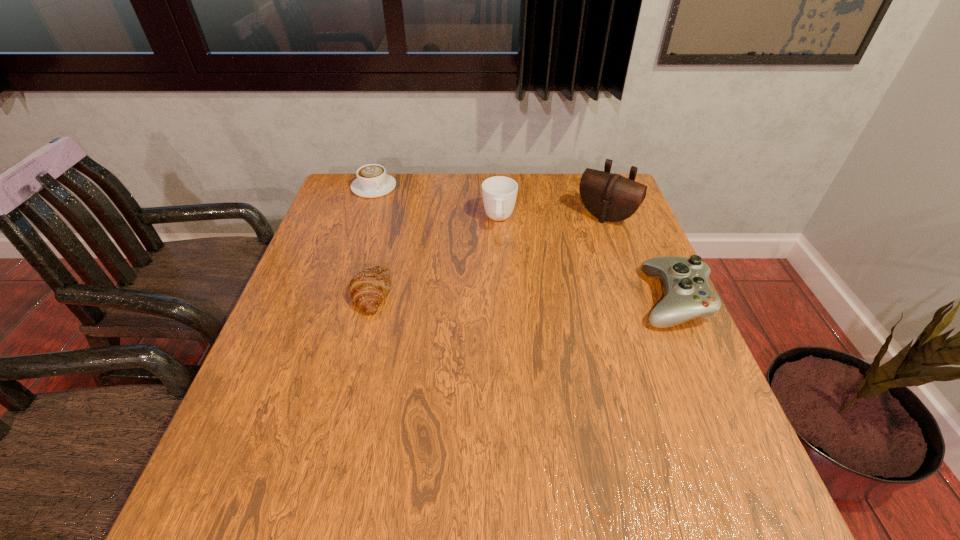
The image size is (960, 540). I want to click on vacant spot on the desktop that is between the crescent roll and the control and is positioned with the handle on the right side of the farthest object, so click(x=477, y=295).

This screenshot has height=540, width=960. Identify the location of free space on the desktop that is between the crescent roll and the third tallest object and is positioned with the handle on the side of the cup. (496, 295).

Image resolution: width=960 pixels, height=540 pixels. Identify the location of vacant space on the desktop that is between the crescent roll and the third tallest object and is positioned with the flap open on the tallest object. (542, 296).